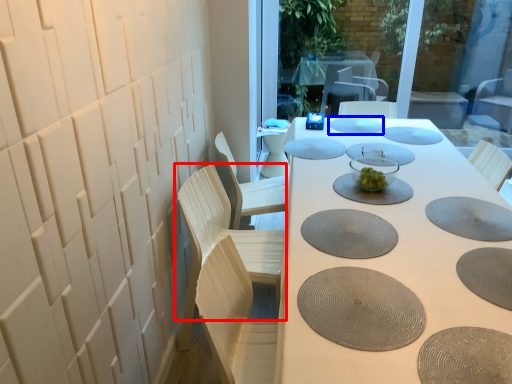
Question: Which point is further to the camera, chair (highlighted by a red box) or manhole cover (highlighted by a blue box)?

Choices:
 (A) chair
 (B) manhole cover

Answer: (B)